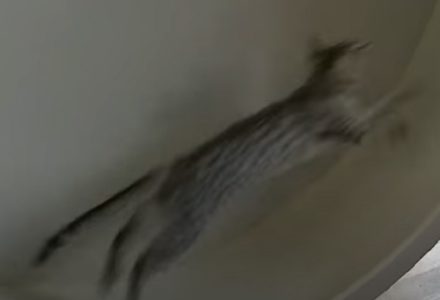
You are a GUI agent. You are given a task and a screenshot of the screen. Output one action in this format:
    pyautogui.click(x=<x>, y=<y>)
    Task: Click on the wall
    
    Given the screenshot: What is the action you would take?
    pyautogui.click(x=65, y=89), pyautogui.click(x=271, y=254), pyautogui.click(x=407, y=19)